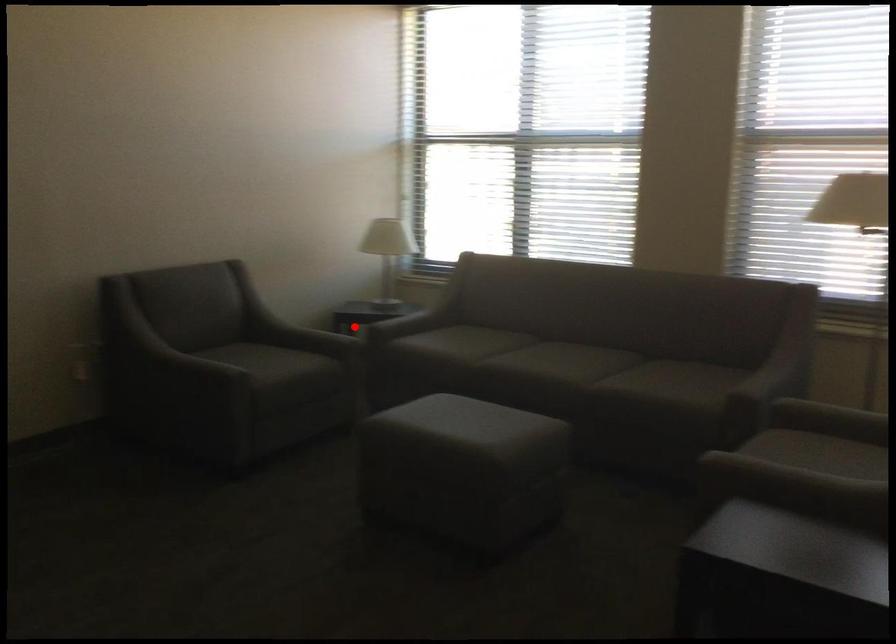
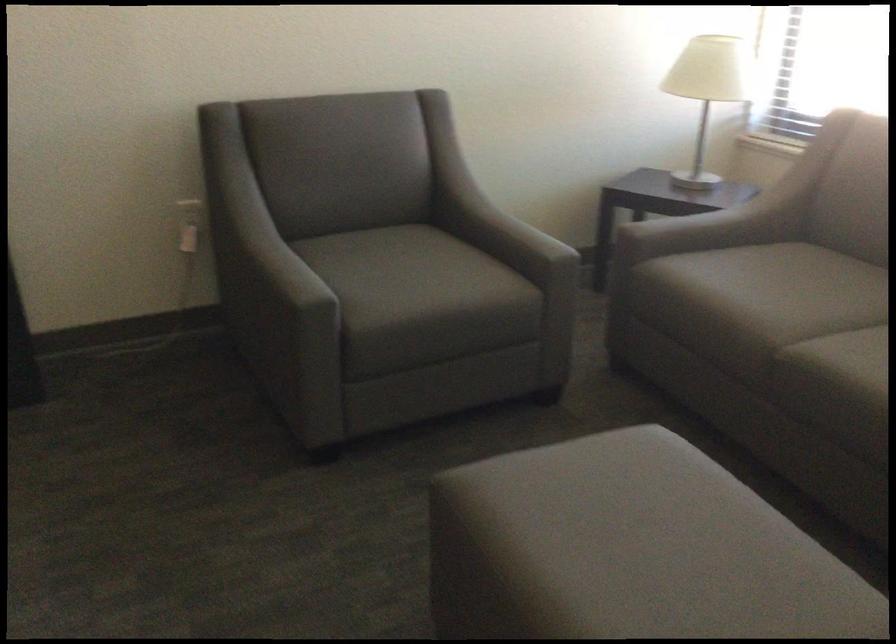
Where in the second image is the point corresponding to the highlighted location from the first image?

(643, 214)